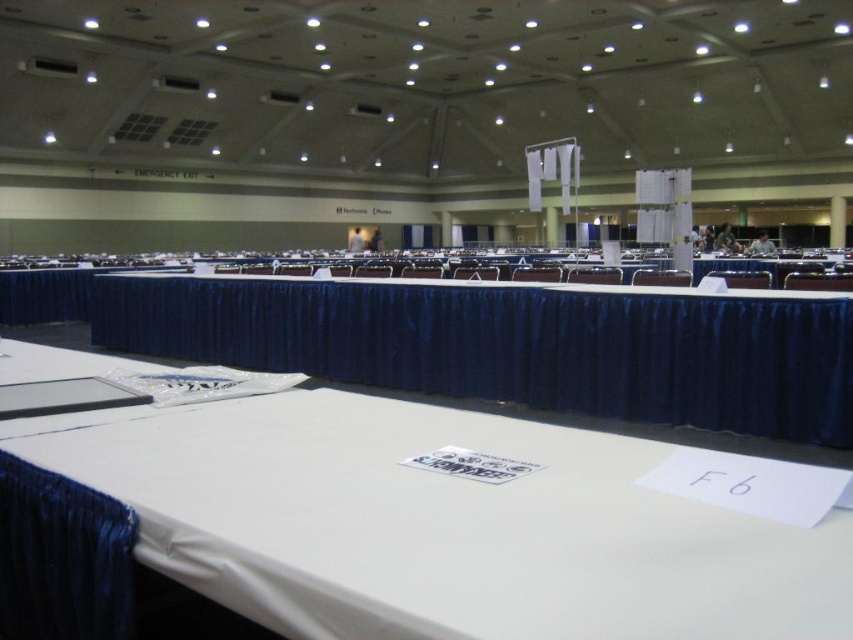
Can you confirm if white paper at center is smaller than white fabric tablecloth at center?

Incorrect, white paper at center is not smaller in size than white fabric tablecloth at center.

Is white paper at center to the right of white fabric tablecloth at center from the viewer's perspective?

Incorrect, white paper at center is not on the right side of white fabric tablecloth at center.

Is point (329, 577) less distant than point (535, 310)?

That is True.

Find the location of a particular element. Image resolution: width=853 pixels, height=640 pixels. white paper at center is located at coordinates (439, 524).

Image resolution: width=853 pixels, height=640 pixels. Identify the location of white paper at center. (439, 524).

Who is lower down, white paper at center or matte black chair at right?

white paper at center is below.

Describe the element at coordinates (439, 524) in the screenshot. Image resolution: width=853 pixels, height=640 pixels. I see `white paper at center` at that location.

The width and height of the screenshot is (853, 640). Identify the location of white paper at center. (439, 524).

Based on the photo, can you confirm if white fabric tablecloth at center is thinner than white plastic chair at center?

In fact, white fabric tablecloth at center might be wider than white plastic chair at center.

Is point (219, 285) positioned behind point (747, 288)?

That is True.

What do you see at coordinates (514, 346) in the screenshot?
I see `white fabric tablecloth at center` at bounding box center [514, 346].

You are a GUI agent. You are given a task and a screenshot of the screen. Output one action in this format:
    pyautogui.click(x=<x>, y=<y>)
    Task: Click on the white fabric tablecloth at center
    This screenshot has height=640, width=853.
    Given the screenshot: What is the action you would take?
    pyautogui.click(x=514, y=346)